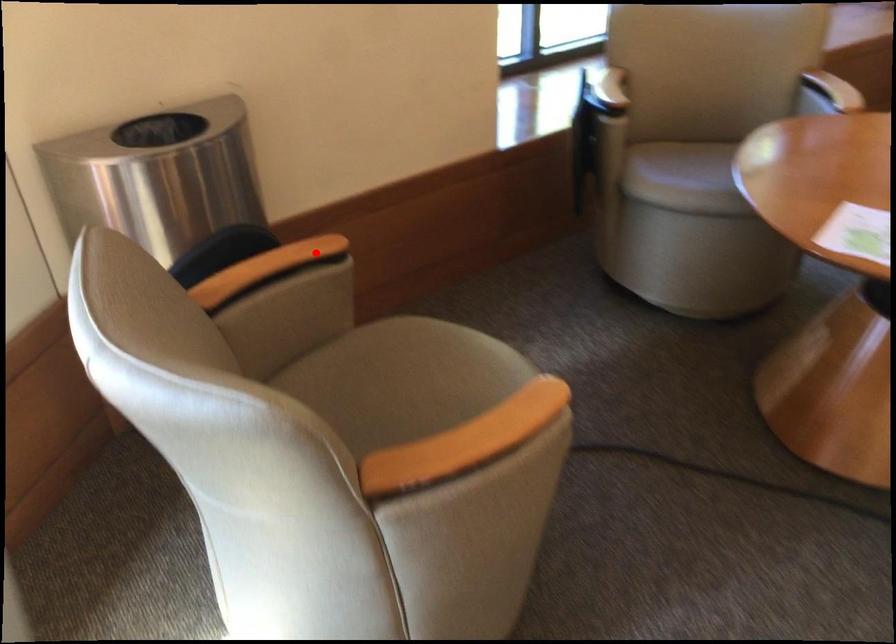
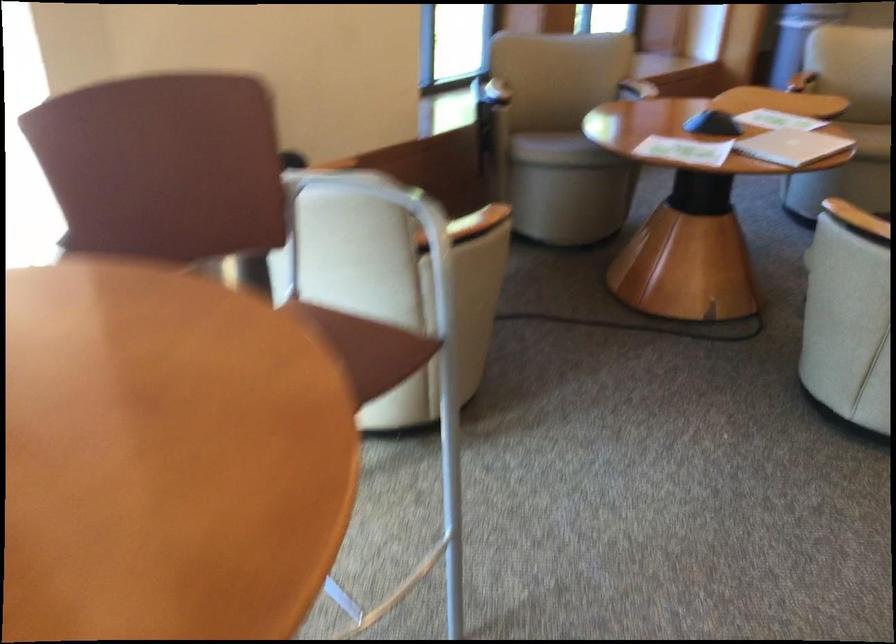
Question: A red point is marked in image1. In image2, is the corresponding 3D point closer to the camera or farther? Reply with the corresponding letter.

Choices:
 (A) The corresponding 3D point is closer.
 (B) The corresponding 3D point is farther.

Answer: (B)